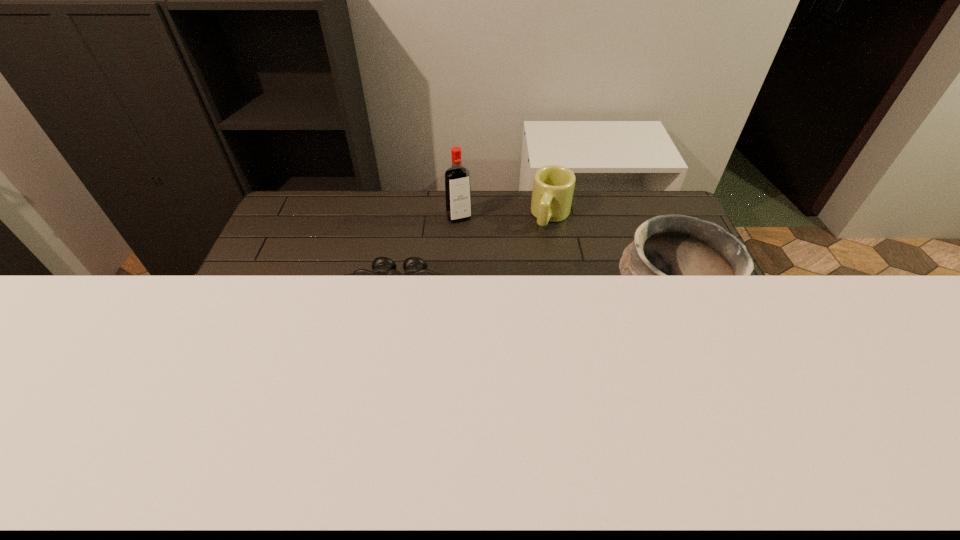
Locate an element on the screen. This screenshot has width=960, height=540. free space located 0.390m on the front and back of the vodka is located at coordinates (502, 304).

Where is `free spot located 0.350m on the front and back of the vodka`? free spot located 0.350m on the front and back of the vodka is located at coordinates (497, 294).

This screenshot has height=540, width=960. I want to click on free space located 0.320m on the front and back of the vodka, so click(493, 288).

Identify the location of mug that is at the far edge. (553, 186).

Locate an element on the screen. vodka that is at the far edge is located at coordinates (457, 178).

The width and height of the screenshot is (960, 540). Identify the location of object situated at the right edge. (670, 245).

The image size is (960, 540). What are the coordinates of `free point at the far edge` in the screenshot? It's located at (409, 202).

The image size is (960, 540). I want to click on free space at the near edge, so click(x=554, y=390).

In order to click on free space at the left edge of the desktop in this screenshot , I will do `click(209, 364)`.

Identify the location of vacant space at the right edge. The height and width of the screenshot is (540, 960). (696, 334).